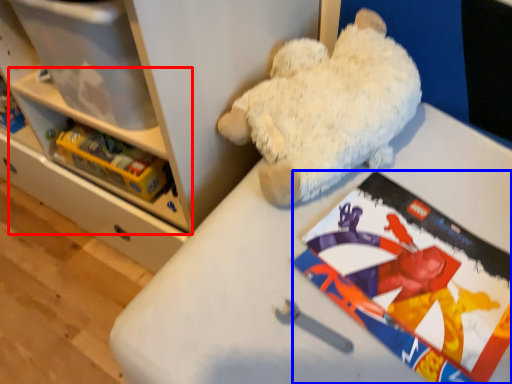
Question: Which object appears farthest to the camera in this image, shelf (highlighted by a red box) or comic book (highlighted by a blue box)?

Choices:
 (A) shelf
 (B) comic book

Answer: (A)